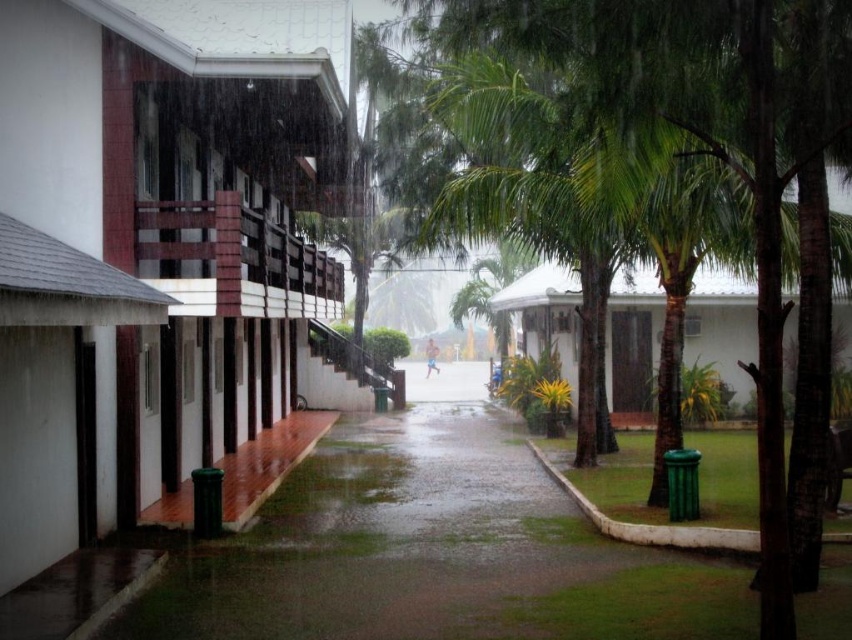
Question: Does green leafy tree at center appear on the left side of smooth skin runner at center?

Choices:
 (A) no
 (B) yes

Answer: (A)

Question: From the image, what is the correct spatial relationship of green leafy tree at center in relation to smooth skin runner at center?

Choices:
 (A) left
 (B) right

Answer: (B)

Question: Is green leafy tree at center above smooth skin runner at center?

Choices:
 (A) yes
 (B) no

Answer: (A)

Question: Which object appears closest to the camera in this image?

Choices:
 (A) smooth skin runner at center
 (B) green leafy tree at center

Answer: (B)